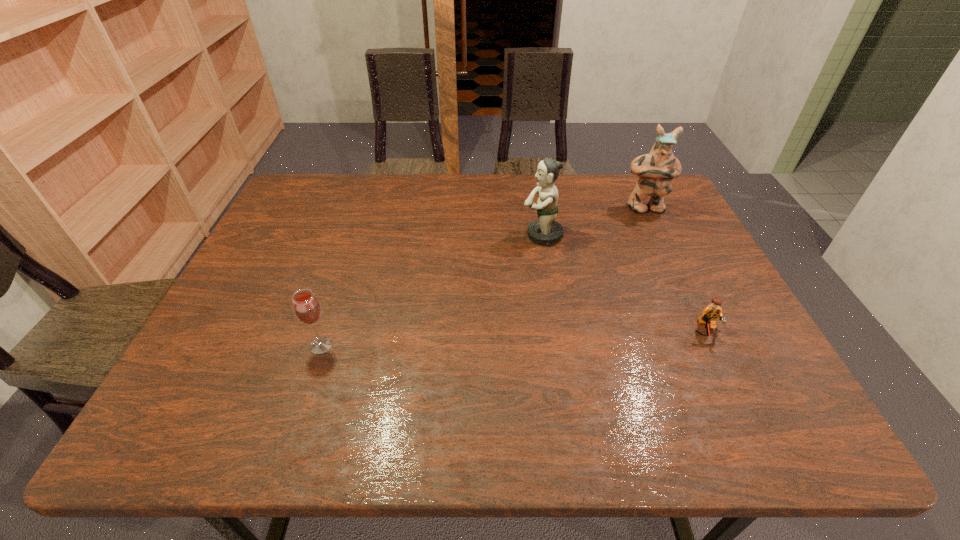
You are a GUI agent. You are given a task and a screenshot of the screen. Output one action in this format:
    pyautogui.click(x=<x>, y=<y>)
    Task: Click on the vacant space at the right edge of the desktop
    This screenshot has height=540, width=960.
    Given the screenshot: What is the action you would take?
    pyautogui.click(x=691, y=320)

This screenshot has width=960, height=540. I want to click on free space at the far left corner, so click(277, 216).

You are a GUI agent. You are given a task and a screenshot of the screen. Output one action in this format:
    pyautogui.click(x=<x>, y=<y>)
    Task: Click on the vacant space at the near left corner of the desktop
    The width and height of the screenshot is (960, 540).
    Given the screenshot: What is the action you would take?
    pyautogui.click(x=149, y=430)

Where is `unoccupied area between the Lego and the right figurine`? The height and width of the screenshot is (540, 960). unoccupied area between the Lego and the right figurine is located at coordinates (675, 269).

The height and width of the screenshot is (540, 960). In order to click on unoccupied area between the farther figurine and the wineglass in this screenshot , I will do `click(483, 276)`.

Identify the location of empty location between the nearer figurine and the Lego. point(624,283).

Where is `free space between the third nearest object and the third tallest object`? This screenshot has height=540, width=960. free space between the third nearest object and the third tallest object is located at coordinates (432, 290).

At what (x,y) coordinates should I click in order to perform the action: click on vacant space in between the farthest object and the third tallest object. Please return your answer as a coordinate pair (x, y). Image resolution: width=960 pixels, height=540 pixels. Looking at the image, I should click on (483, 276).

Where is `free space between the second farthest object and the Lego`? The image size is (960, 540). free space between the second farthest object and the Lego is located at coordinates (624, 283).

This screenshot has height=540, width=960. I want to click on free point between the shortest object and the third object from right to left, so click(x=624, y=283).